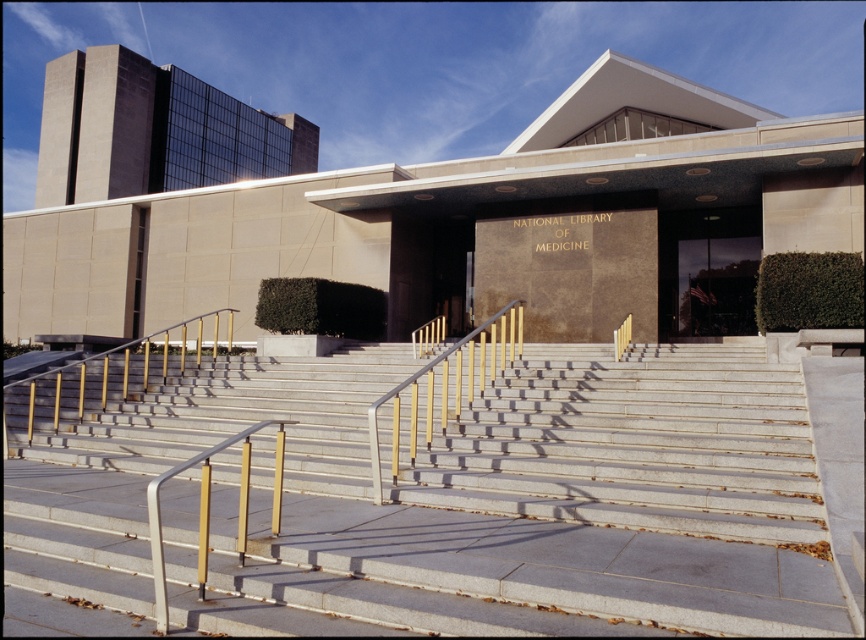
From the picture: You are a visitor approaching the National Library of Medicine. You see the granite stairs at center and the gold metallic handrail at lower left. Which object is closer to you as you approach the entrance?

The granite stairs at center is closer to you because it is in front of the gold metallic handrail at lower left.

You are a delivery person carrying a large crate that is 2 meters wide. You arrive at the National Library of Medicine and need to enter through the entrance. The entrance has both the granite stairs at center and the glass door at center. Which feature of the entrance can accommodate your crate? Please explain your reasoning.

The granite stairs at center are wider than the glass door at center. Since your crate is 2 meters wide, the granite stairs at center can accommodate it, while the glass door at center may be too narrow.